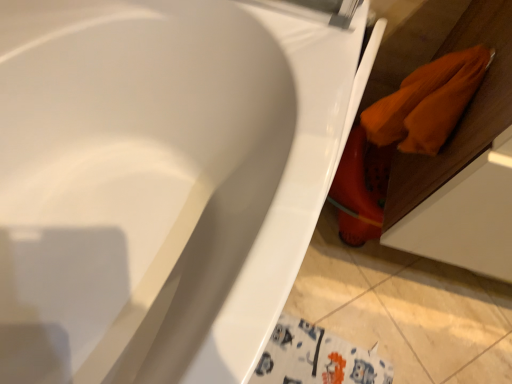
The image size is (512, 384). Identify the location of free space above white fabric at lower center (from a real-world perspective). (325, 356).